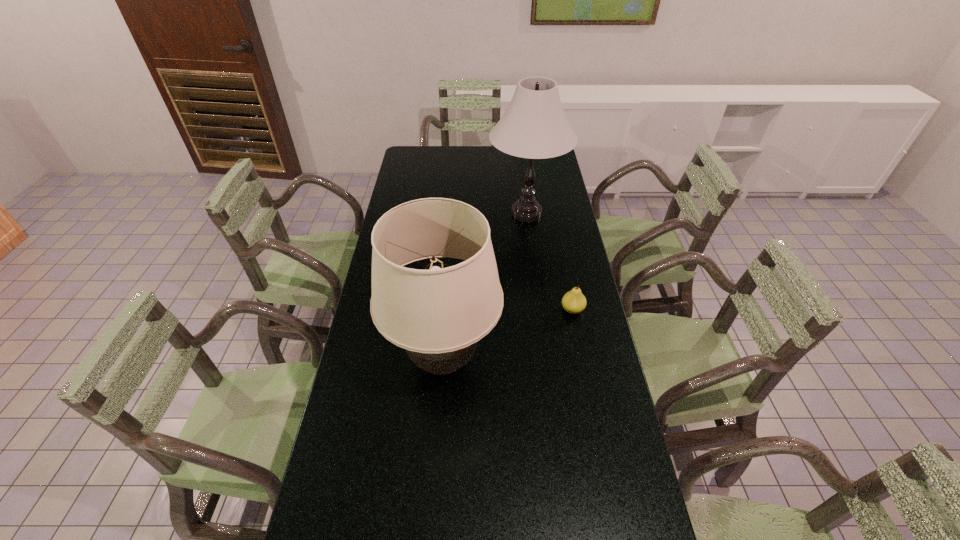
Locate an element on the screen. The width and height of the screenshot is (960, 540). lamp is located at coordinates (534, 126).

The width and height of the screenshot is (960, 540). What are the coordinates of `lampshade` in the screenshot? It's located at (438, 316).

Locate an element on the screen. Image resolution: width=960 pixels, height=540 pixels. the shortest object is located at coordinates (574, 302).

Find the location of a particular element. Image resolution: width=960 pixels, height=540 pixels. vacant space situated 0.070m on the back of the farthest object is located at coordinates (522, 183).

Image resolution: width=960 pixels, height=540 pixels. I want to click on free space located on the front of the lampshade, so click(x=437, y=449).

Find the location of `vacant region located on the front of the shortest object`. vacant region located on the front of the shortest object is located at coordinates (577, 334).

Locate an element on the screen. object that is positioned at the left edge is located at coordinates (438, 316).

Locate an element on the screen. The width and height of the screenshot is (960, 540). lamp located in the right edge section of the desktop is located at coordinates (534, 126).

Identify the location of pear that is positioned at the right edge. (574, 302).

Find the location of a particular element. vacant space at the left edge is located at coordinates (357, 460).